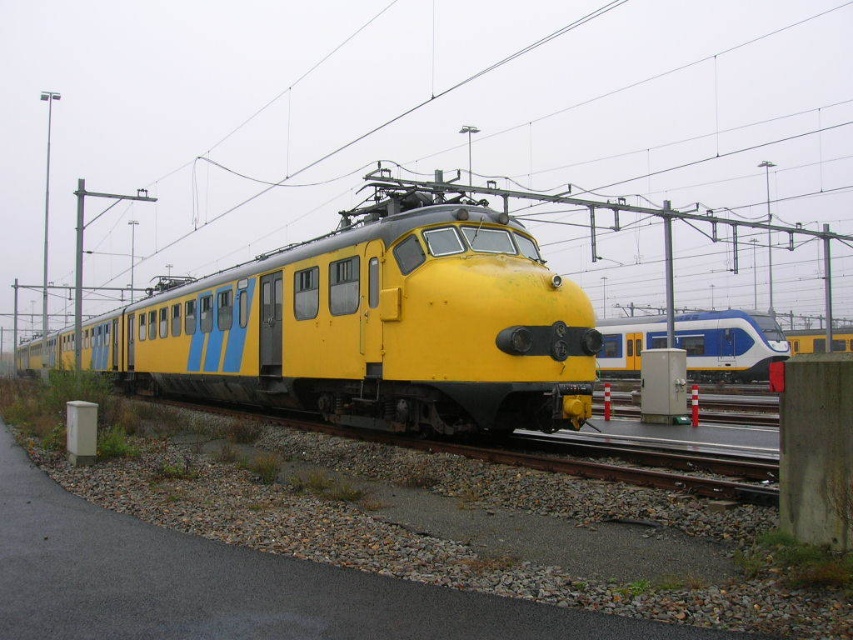
Between yellow matte train at center and blue glossy train at right, which one appears on the left side from the viewer's perspective?

yellow matte train at center

The width and height of the screenshot is (853, 640). In order to click on yellow matte train at center in this screenshot , I will do `click(366, 326)`.

Does point (482, 301) lie behind point (677, 326)?

No, it is in front of (677, 326).

This screenshot has width=853, height=640. I want to click on yellow matte train at center, so click(x=366, y=326).